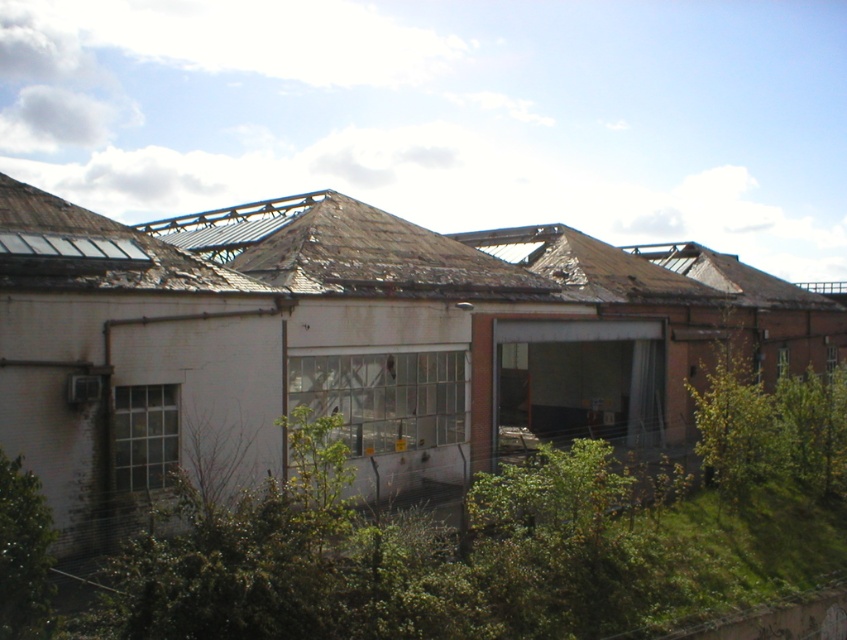
Question: Which of the following is the closest to the observer?

Choices:
 (A) weathered brown roof at upper center
 (B) green leafy shrub at center

Answer: (B)

Question: Is green leafy shrub at center above green leafy bush at lower left?

Choices:
 (A) no
 (B) yes

Answer: (A)

Question: Where is green leafy shrub at center located in relation to green leafy bush at lower left in the image?

Choices:
 (A) below
 (B) above

Answer: (A)

Question: Which of the following is the farthest from the observer?

Choices:
 (A) (37, 564)
 (B) (264, 483)

Answer: (B)

Question: Which of these objects is positioned closest to the weathered brown roof at upper center?

Choices:
 (A) green leafy shrub at center
 (B) green leafy bush at lower left

Answer: (A)

Question: Can you confirm if weathered brown roof at upper center is positioned below green leafy bush at lower left?

Choices:
 (A) no
 (B) yes

Answer: (A)